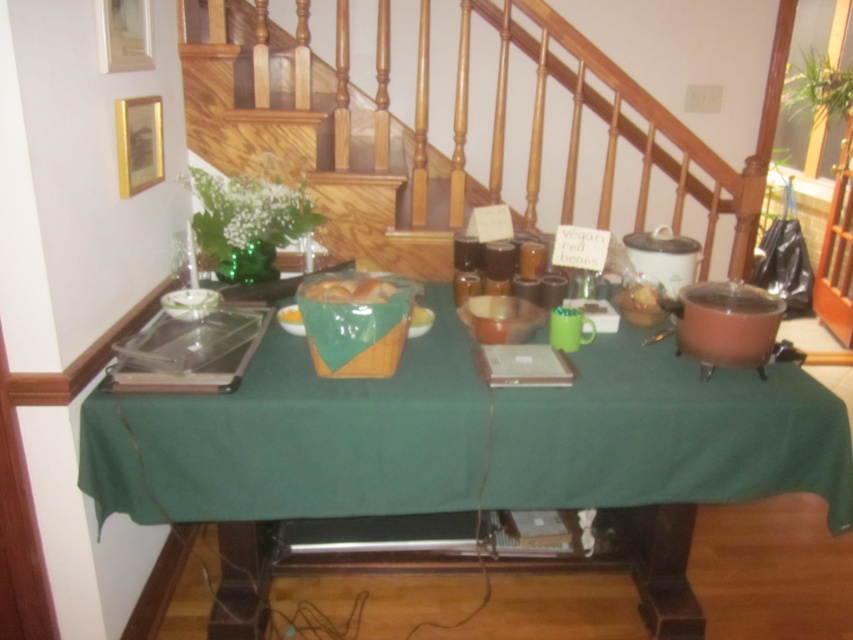
Question: Which object appears closest to the camera in this image?

Choices:
 (A) green fabric table at center
 (B) yellow matte bread at center
 (C) wooden stairs at center

Answer: (A)

Question: Which object appears farthest from the camera in this image?

Choices:
 (A) matte wooden bread basket at center
 (B) green fabric table at center
 (C) yellow matte bowl at center
 (D) yellow matte bread at center

Answer: (D)

Question: Is matte wooden bread basket at center to the right of yellow matte bowl at center from the viewer's perspective?

Choices:
 (A) no
 (B) yes

Answer: (A)

Question: Does wooden stairs at center have a greater width compared to yellow matte bowl at center?

Choices:
 (A) no
 (B) yes

Answer: (B)

Question: From the image, what is the correct spatial relationship of green fabric table at center in relation to yellow matte bowl at center?

Choices:
 (A) right
 (B) left

Answer: (A)

Question: Which of the following is the closest to the observer?

Choices:
 (A) (271, 22)
 (B) (328, 282)
 (C) (428, 310)
 (D) (741, 493)

Answer: (D)